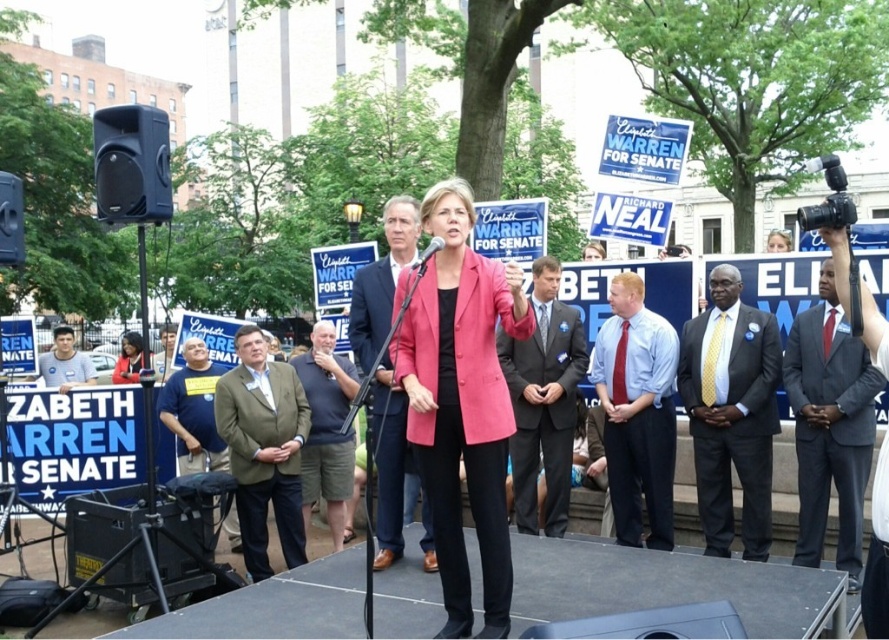
Question: Is matte blue suit at center thinner than green fabric shirt at center?

Choices:
 (A) no
 (B) yes

Answer: (B)

Question: Considering the real-world distances, which object is farthest from the blue shirt at center?

Choices:
 (A) pink matte blazer at center
 (B) dark gray wool business suit at center

Answer: (B)

Question: Does blue t-shirt at center appear on the left side of light blue shirt at lower left?

Choices:
 (A) yes
 (B) no

Answer: (B)

Question: Which point is farther to the camera?

Choices:
 (A) pink matte blazer at center
 (B) dark blue cotton shirt at center

Answer: (B)

Question: Considering the real-world distances, which object is closest to the dark blue cotton shirt at center?

Choices:
 (A) matte black jacket at lower left
 (B) dark gray suit at center
 (C) light blue shirt at lower left
 (D) dark gray wool business suit at center

Answer: (B)

Question: Considering the relative positions of gray suit at center and matte black jacket at lower left in the image provided, where is gray suit at center located with respect to matte black jacket at lower left?

Choices:
 (A) left
 (B) right

Answer: (B)